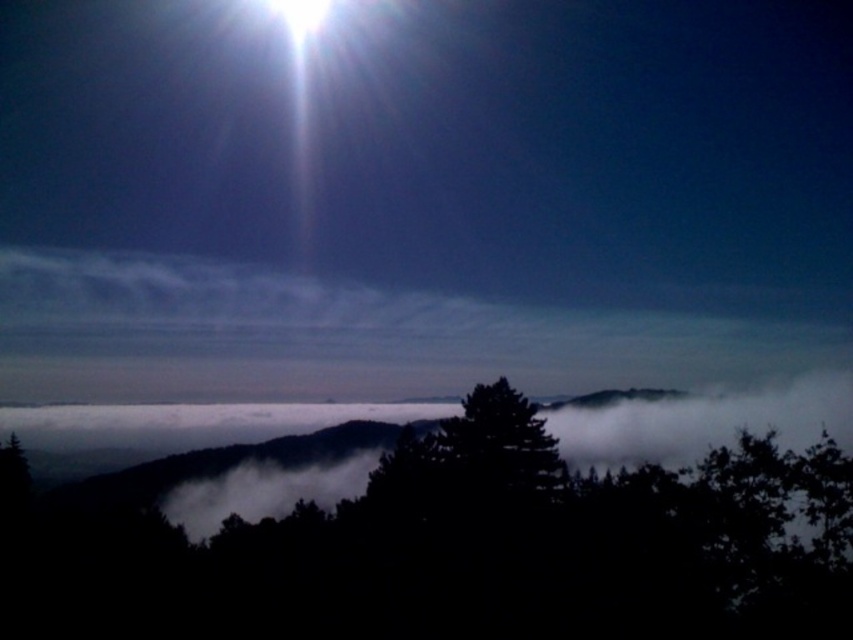
Question: Is dark green leafy tree at center to the left of bright white light at upper center from the viewer's perspective?

Choices:
 (A) no
 (B) yes

Answer: (A)

Question: Does dark green leafy tree at center appear on the left side of bright white light at upper center?

Choices:
 (A) yes
 (B) no

Answer: (B)

Question: Which object appears closest to the camera in this image?

Choices:
 (A) bright white light at upper center
 (B) dark green leafy tree at center

Answer: (B)

Question: Which point appears closest to the camera in this image?

Choices:
 (A) (329, 536)
 (B) (320, 20)

Answer: (A)

Question: Which point is closer to the camera?

Choices:
 (A) bright white light at upper center
 (B) dark green leafy tree at center

Answer: (B)

Question: Is dark green leafy tree at center above bright white light at upper center?

Choices:
 (A) yes
 (B) no

Answer: (B)